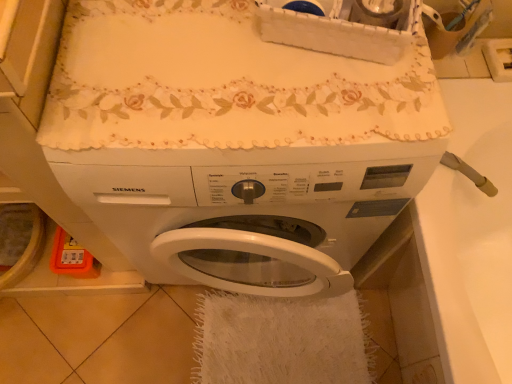
Question: From the image's perspective, is white matte washing machine at center beneath white fluffy bath towel at lower center?

Choices:
 (A) no
 (B) yes

Answer: (A)

Question: From a real-world perspective, is white matte washing machine at center over white fluffy bath towel at lower center?

Choices:
 (A) yes
 (B) no

Answer: (A)

Question: Can you confirm if white matte washing machine at center is thinner than white fluffy bath towel at lower center?

Choices:
 (A) yes
 (B) no

Answer: (A)

Question: Is white matte washing machine at center behind white fluffy bath towel at lower center?

Choices:
 (A) no
 (B) yes

Answer: (A)

Question: Is white matte washing machine at center at the right side of white fluffy bath towel at lower center?

Choices:
 (A) yes
 (B) no

Answer: (B)

Question: Considering the relative sizes of white matte washing machine at center and white fluffy bath towel at lower center in the image provided, is white matte washing machine at center taller than white fluffy bath towel at lower center?

Choices:
 (A) no
 (B) yes

Answer: (B)

Question: From a real-world perspective, does white glossy sink at right sit lower than white fluffy bath towel at lower center?

Choices:
 (A) no
 (B) yes

Answer: (A)

Question: Is white glossy sink at right looking in the opposite direction of white fluffy bath towel at lower center?

Choices:
 (A) no
 (B) yes

Answer: (A)

Question: Is white glossy sink at right not near white fluffy bath towel at lower center?

Choices:
 (A) yes
 (B) no

Answer: (B)

Question: Is white glossy sink at right outside white fluffy bath towel at lower center?

Choices:
 (A) yes
 (B) no

Answer: (A)

Question: From a real-world perspective, is white glossy sink at right on white fluffy bath towel at lower center?

Choices:
 (A) yes
 (B) no

Answer: (A)

Question: From the image's perspective, is white glossy sink at right on white fluffy bath towel at lower center?

Choices:
 (A) no
 (B) yes

Answer: (B)

Question: Can we say white fluffy bath towel at lower center lies outside white glossy sink at right?

Choices:
 (A) yes
 (B) no

Answer: (A)